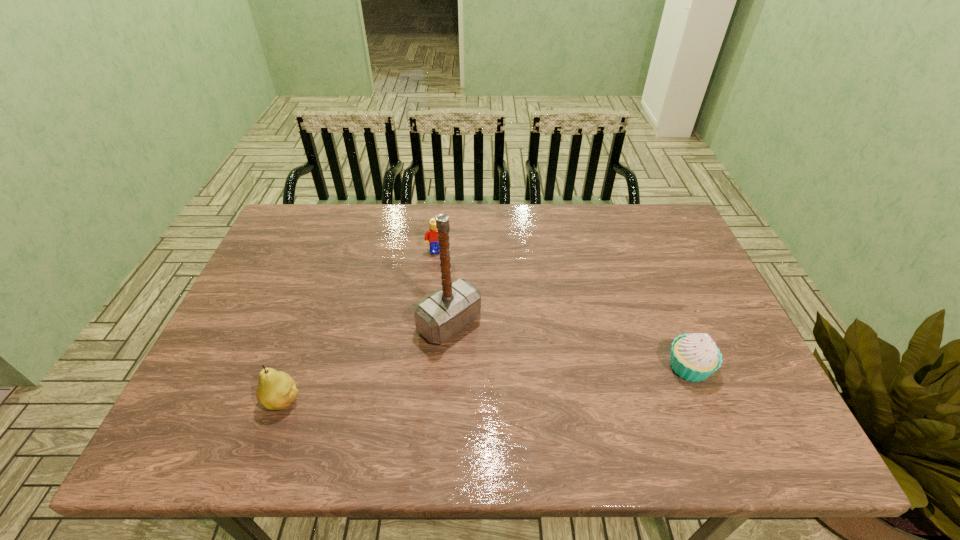
Locate an element on the screen. This screenshot has height=540, width=960. vacant area that lies between the cupcake and the pear is located at coordinates (486, 383).

Locate an element on the screen. This screenshot has width=960, height=540. the second closest object relative to the cupcake is located at coordinates (431, 234).

Select which object appears as the third closest to the pear. Please provide its 2D coordinates. Your answer should be formatted as a tuple, i.e. [(x, y)], where the tuple contains the x and y coordinates of a point satisfying the conditions above.

[(694, 357)]

At what (x,y) coordinates should I click in order to perform the action: click on free space that satisfies the following two spatial constraints: 1. on the front side of the third nearest object; 2. on the left side of the rightmost object. Please return your answer as a coordinate pair (x, y). The image size is (960, 540). Looking at the image, I should click on (446, 367).

Image resolution: width=960 pixels, height=540 pixels. What are the coordinates of `free space that satisfies the following two spatial constraints: 1. on the back side of the pear; 2. on the left side of the cupcake` in the screenshot? It's located at click(x=296, y=367).

Locate an element on the screen. This screenshot has width=960, height=540. vacant region that satisfies the following two spatial constraints: 1. on the front side of the second farthest object; 2. on the right side of the farthest object is located at coordinates (430, 323).